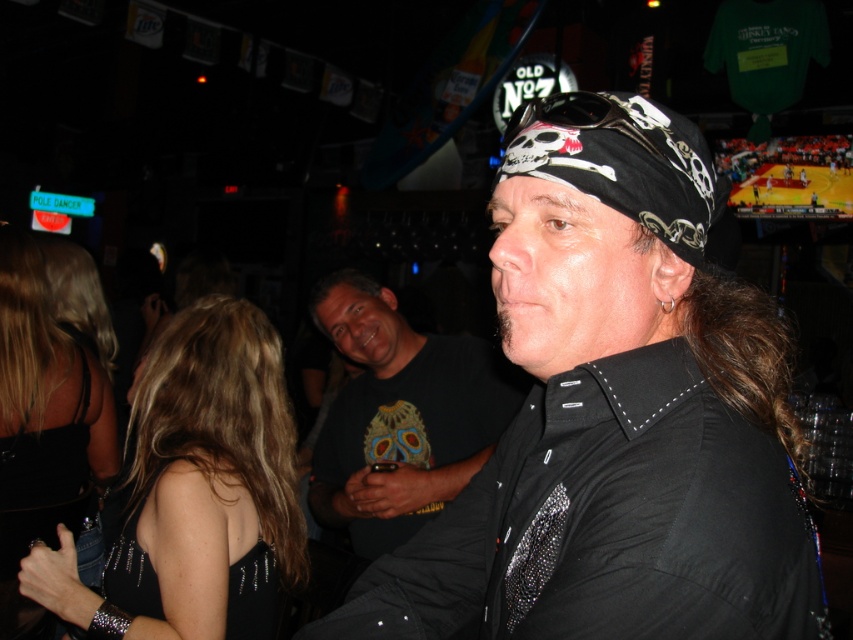
Question: Among these points, which one is farthest from the camera?

Choices:
 (A) (49, 420)
 (B) (265, 392)
 (C) (399, 481)
 (D) (517, 481)

Answer: (A)

Question: Is black sequined dress at left positioned at the back of black satin dress at lower left?

Choices:
 (A) yes
 (B) no

Answer: (B)

Question: Considering the real-world distances, which object is farthest from the black sequined dress at left?

Choices:
 (A) black satin shirt at center
 (B) black textured shirt at center

Answer: (A)

Question: Among these points, which one is nearest to the camera?

Choices:
 (A) (693, 282)
 (B) (389, 512)

Answer: (A)

Question: Can you confirm if black sequined dress at left is thinner than black satin dress at lower left?

Choices:
 (A) no
 (B) yes

Answer: (A)

Question: Observing the image, what is the correct spatial positioning of black sequined dress at left in reference to black satin dress at lower left?

Choices:
 (A) below
 (B) above

Answer: (A)